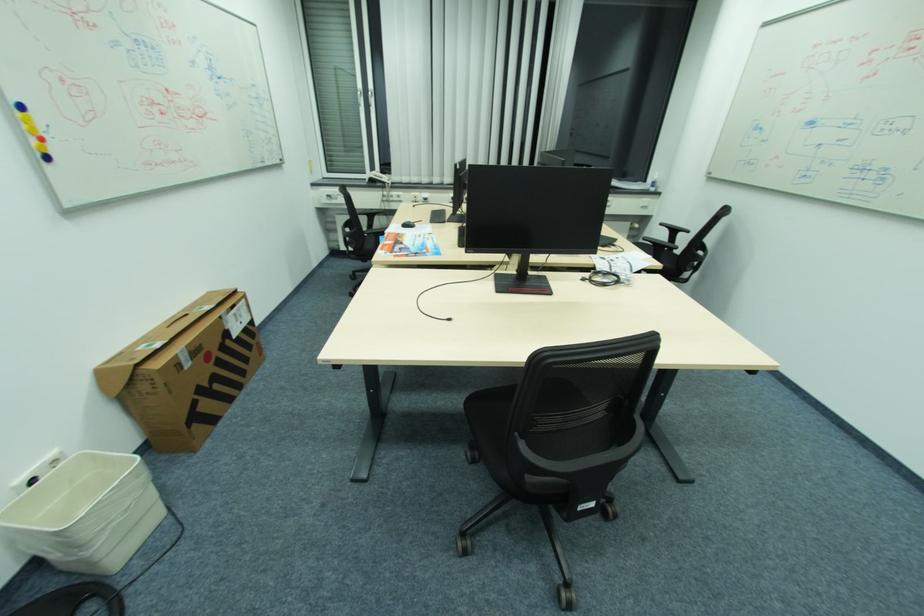
The location [407,224] corresponds to which object?

It refers to a computer mouse.